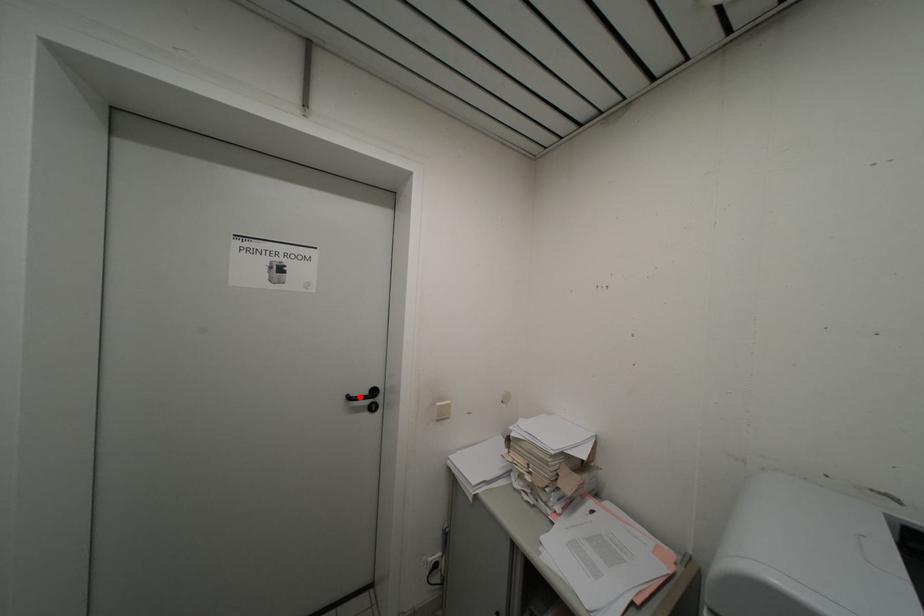
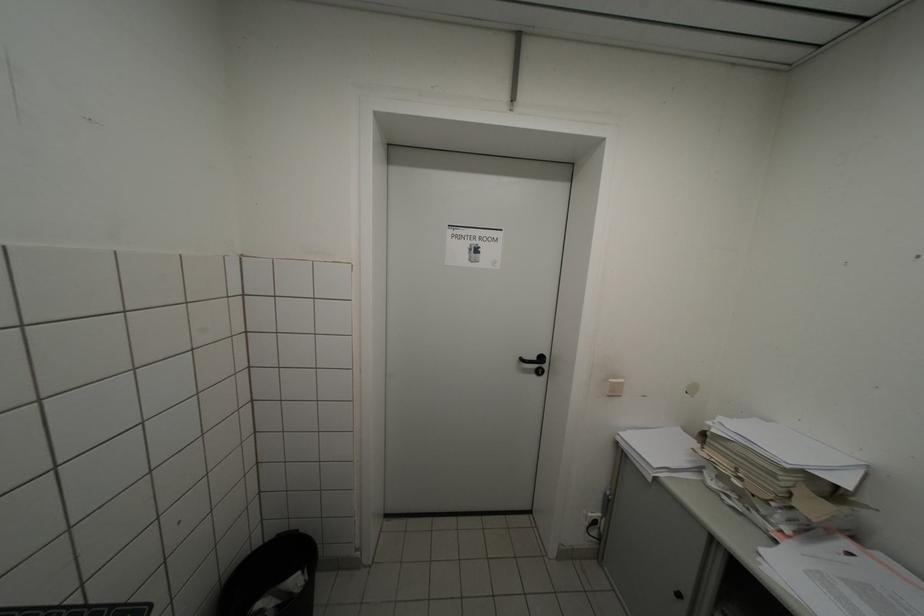
Locate, in the second image, the point that corresponds to the highlighted location in the first image.

(532, 361)